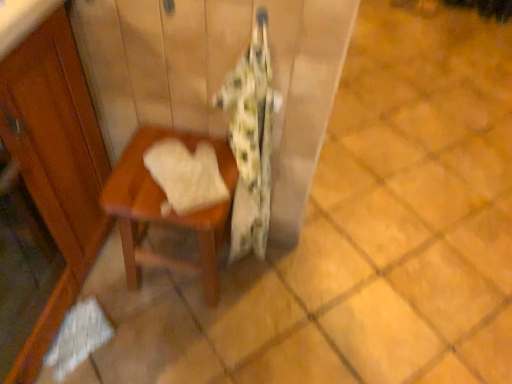
Question: Is fluffy white blanket at center smaller than white soft towel at center?

Choices:
 (A) no
 (B) yes

Answer: (A)

Question: Can white soft towel at center be found inside fluffy white blanket at center?

Choices:
 (A) no
 (B) yes

Answer: (A)

Question: Is fluffy white blanket at center at the left side of white soft towel at center?

Choices:
 (A) no
 (B) yes

Answer: (A)

Question: Could you tell me if fluffy white blanket at center is facing white soft towel at center?

Choices:
 (A) no
 (B) yes

Answer: (A)

Question: From the image's perspective, is fluffy white blanket at center on white soft towel at center?

Choices:
 (A) no
 (B) yes

Answer: (A)

Question: From a real-world perspective, relative to fluffy white blanket at center, is wooden table at center vertically above or below?

Choices:
 (A) below
 (B) above

Answer: (A)

Question: Is wooden table at center taller or shorter than fluffy white blanket at center?

Choices:
 (A) tall
 (B) short

Answer: (B)

Question: From the image's perspective, relative to fluffy white blanket at center, is wooden table at center above or below?

Choices:
 (A) below
 (B) above

Answer: (A)

Question: Is wooden table at center to the left or to the right of fluffy white blanket at center in the image?

Choices:
 (A) left
 (B) right

Answer: (A)

Question: Is fluffy white blanket at center spatially inside white soft towel at center, or outside of it?

Choices:
 (A) outside
 (B) inside

Answer: (A)

Question: From a real-world perspective, relative to white soft towel at center, is fluffy white blanket at center vertically above or below?

Choices:
 (A) above
 (B) below

Answer: (B)

Question: Looking at their shapes, would you say fluffy white blanket at center is wider or thinner than white soft towel at center?

Choices:
 (A) thin
 (B) wide

Answer: (A)

Question: Looking at the image, does fluffy white blanket at center seem bigger or smaller compared to white soft towel at center?

Choices:
 (A) big
 (B) small

Answer: (A)

Question: Which is correct: white soft towel at center is inside wooden table at center, or outside of it?

Choices:
 (A) outside
 (B) inside

Answer: (A)

Question: Is point (210, 205) positioned closer to the camera than point (125, 248)?

Choices:
 (A) farther
 (B) closer

Answer: (B)